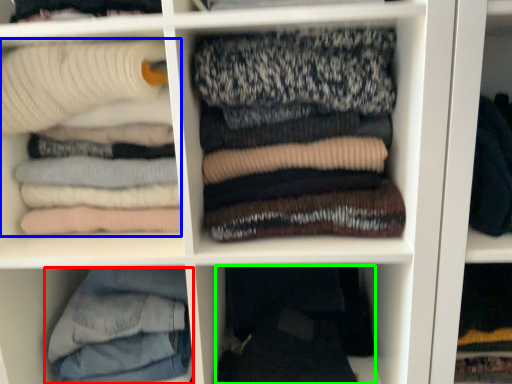
Question: Which object is the farthest from trousers (highlighted by a red box)? Choose among these: laundry (highlighted by a blue box) or clothing (highlighted by a green box).

Choices:
 (A) laundry
 (B) clothing

Answer: (A)